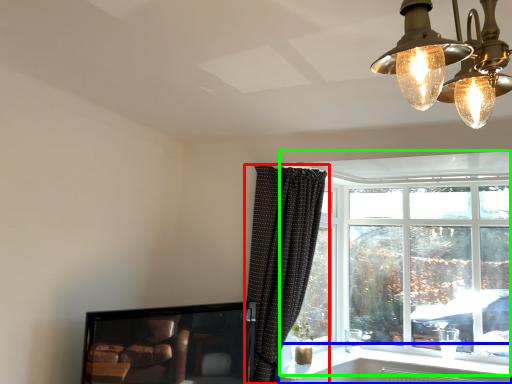
Question: Which object is the farthest from curtain (highlighted by a red box)? Choose among these: window sill (highlighted by a blue box) or window (highlighted by a green box).

Choices:
 (A) window sill
 (B) window

Answer: (B)